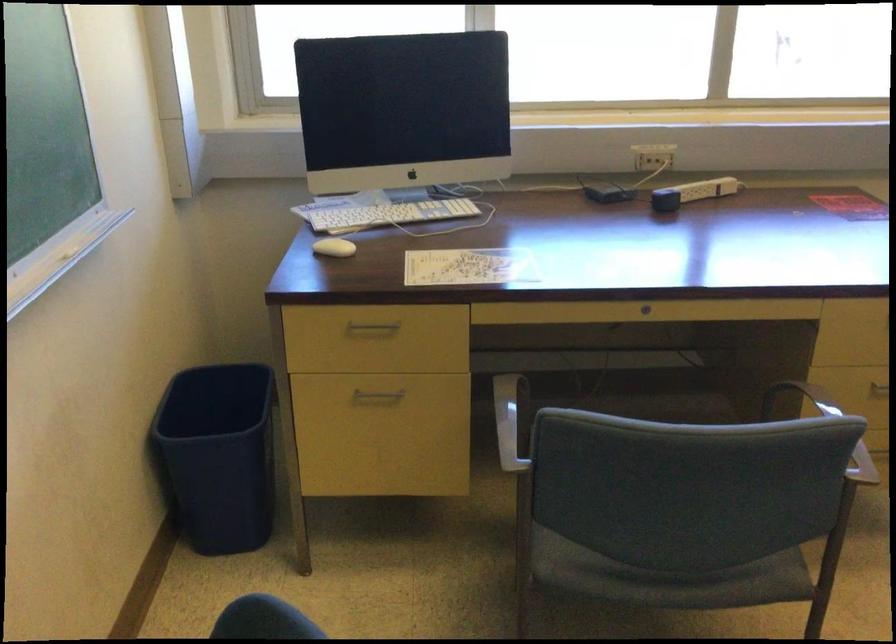
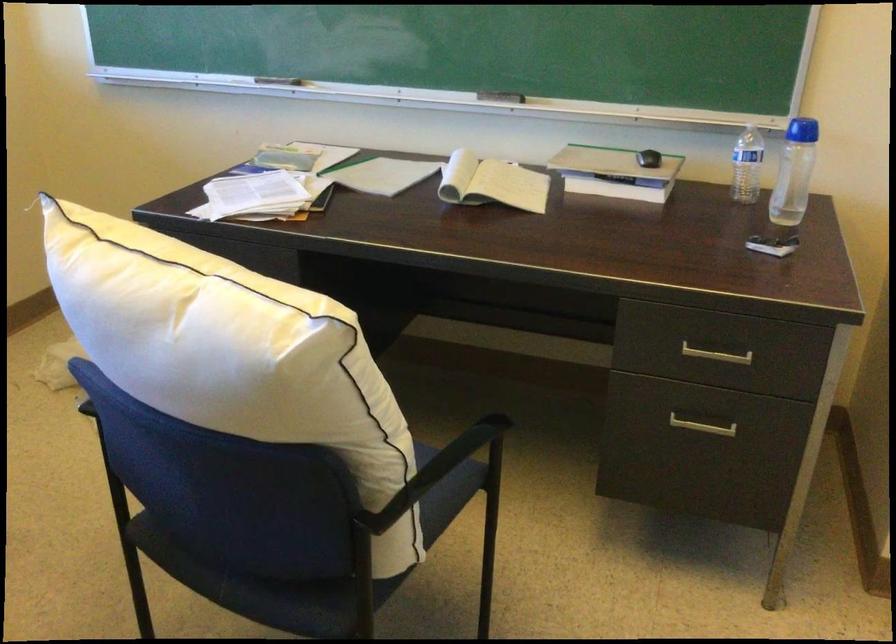
Question: The camera is either moving clockwise (left) or counter-clockwise (right) around the object. The first image is from the beginning of the video and the second image is from the end. Is the camera moving left or right when shooting the video?

Choices:
 (A) Left
 (B) Right

Answer: (A)